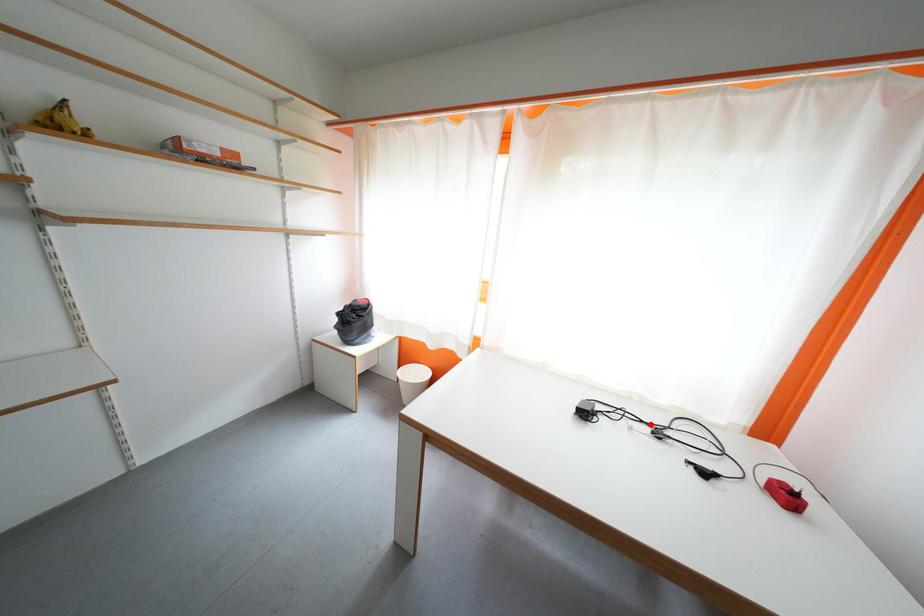
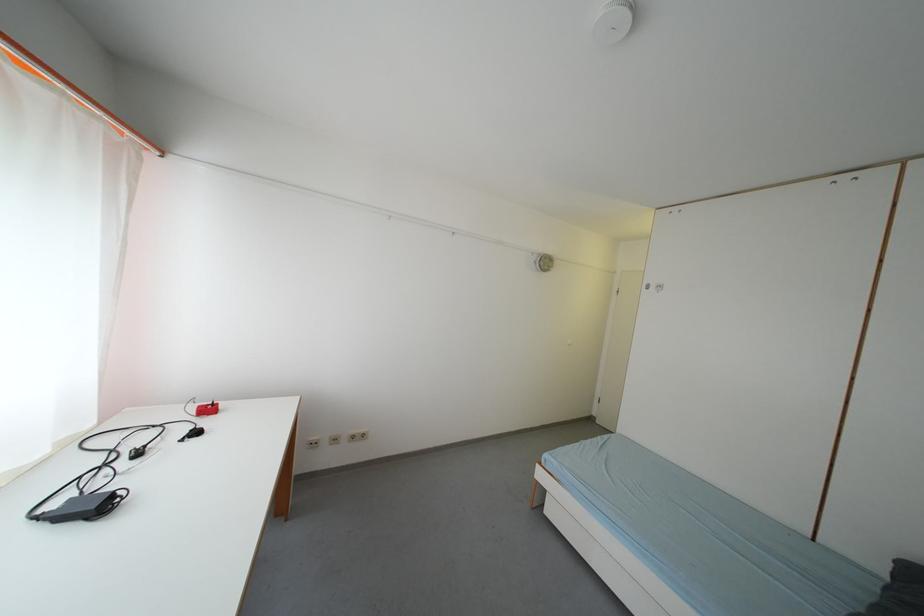
Locate, in the second image, the point that corresponds to the highlighted location in the first image.

(112, 469)